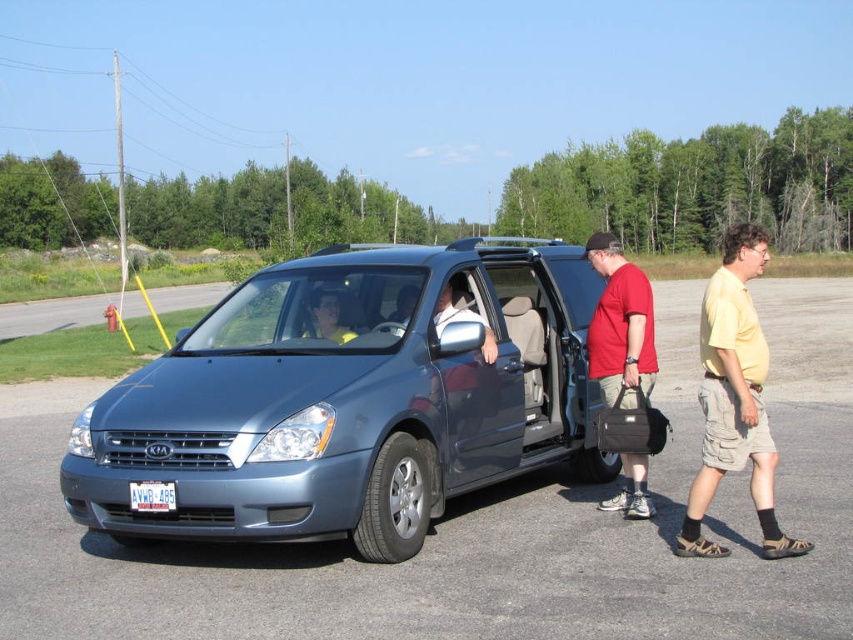
Find the location of a particular element. Image resolution: width=853 pixels, height=640 pixels. satin metallic minivan at center is located at coordinates (349, 397).

Is satin metallic minivan at center behind white plastic license plate at center?

No, satin metallic minivan at center is closer to the viewer.

Is point (368, 328) farther from camera compared to point (138, 497)?

Yes, point (368, 328) is farther from viewer.

Find the location of a particular element. This screenshot has width=853, height=640. satin metallic minivan at center is located at coordinates (349, 397).

Can you confirm if yellow cotton shirt at center is shorter than white plastic license plate at center?

No, yellow cotton shirt at center is not shorter than white plastic license plate at center.

Between yellow cotton shirt at center and white plastic license plate at center, which one is positioned higher?

Positioned higher is yellow cotton shirt at center.

Is point (714, 358) closer to viewer compared to point (170, 490)?

No, it is behind (170, 490).

Locate an element on the screen. yellow cotton shirt at center is located at coordinates (734, 397).

Is the position of yellow cotton shirt at center less distant than that of matte red shirt at center?

Yes, it is.

Can you confirm if yellow cotton shirt at center is shorter than matte red shirt at center?

Yes, yellow cotton shirt at center is shorter than matte red shirt at center.

At what (x,y) coordinates should I click in order to perform the action: click on yellow cotton shirt at center. Please return your answer as a coordinate pair (x, y). Looking at the image, I should click on (734, 397).